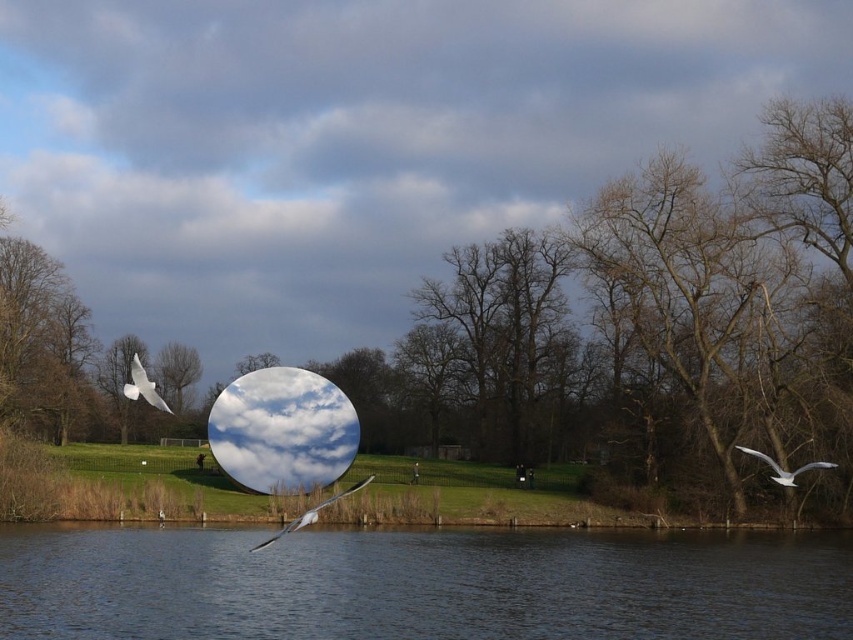
You are standing in the serene outdoor scene and want to observe the white feathered birds. Which of the two birds, the white feathered bird at lower center or the white feathered bird at upper left, appears larger in the image?

The white feathered bird at lower center appears larger because it is closer to the viewer than the white feathered bird at upper left.

You are standing at the edge of the water in the scene. There is a point marked at coordinates (311, 513). What object is located at this point?

The white feathered bird at lower center is represented by point (311, 513).

You are a birdwatcher observing the white feathered bird at lower center and the white feathered bird at right. Which bird appears smaller in size?

The white feathered bird at lower center has a lesser width compared to the white feathered bird at right, so it appears smaller in size.